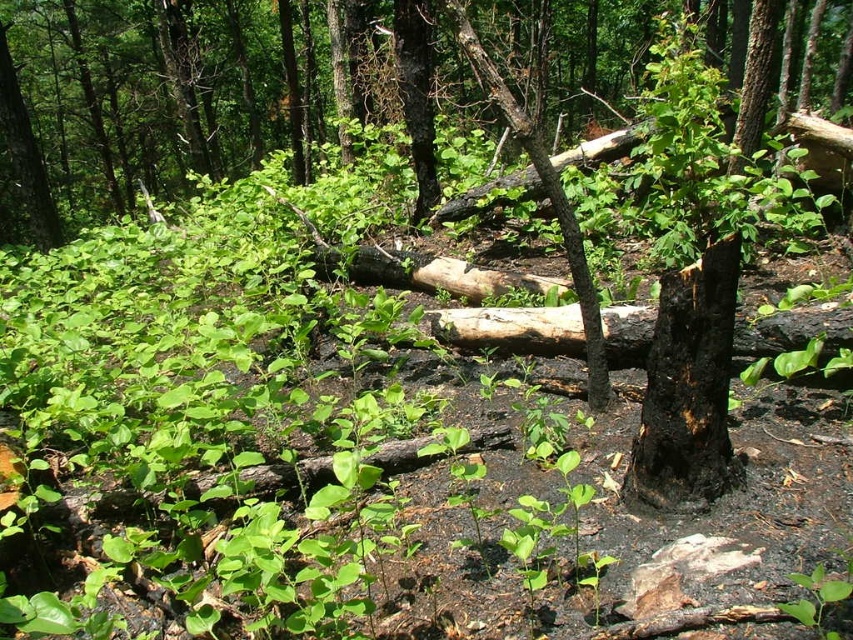
Who is higher up, green leafy tree at center or charcoal black bark at center?

green leafy tree at center is above.

Is point (308, 84) positioned before point (685, 349)?

No, (308, 84) is further to viewer.

The height and width of the screenshot is (640, 853). Identify the location of green leafy tree at center. (148, 99).